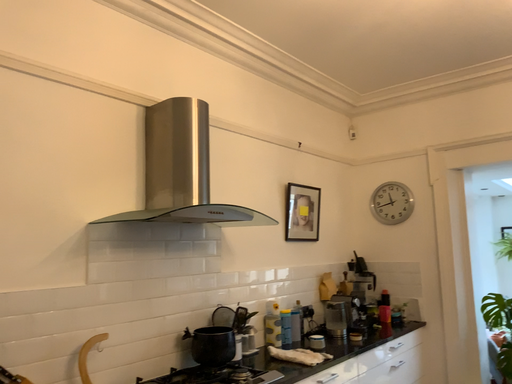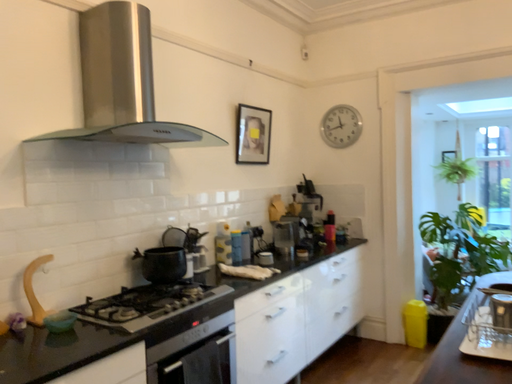
Question: Which way did the camera rotate in the video?

Choices:
 (A) rotated upward
 (B) rotated downward

Answer: (B)